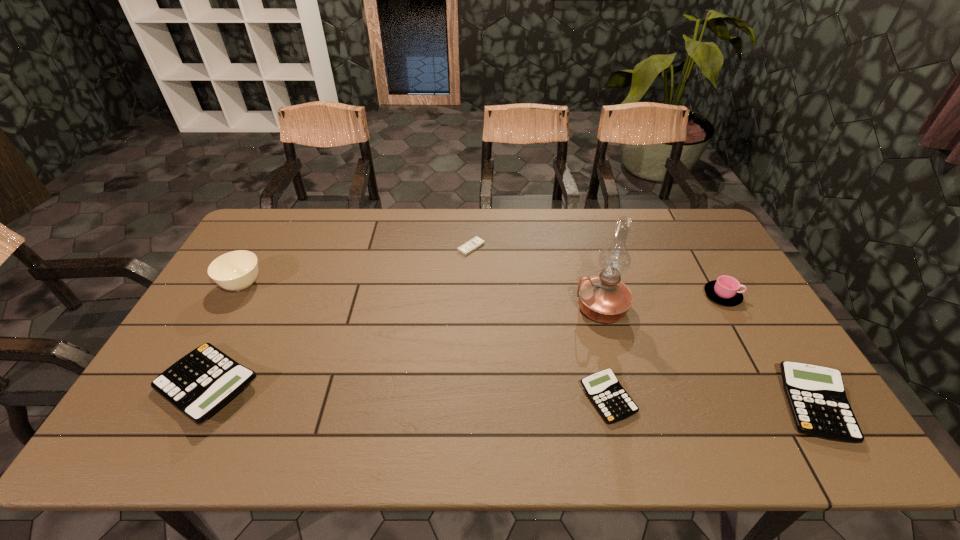
You are a GUI agent. You are given a task and a screenshot of the screen. Output one action in this format:
    pyautogui.click(x=<x>, y=<y>)
    Task: Click on the cup that is at the right edge
    Image resolution: width=960 pixels, height=540 pixels.
    Given the screenshot: What is the action you would take?
    pyautogui.click(x=725, y=290)

Identify the location of object that is at the near left corner. This screenshot has width=960, height=540. click(x=200, y=383).

The width and height of the screenshot is (960, 540). Identify the location of object situated at the near right corner. (816, 395).

You are a GUI agent. You are given a task and a screenshot of the screen. Output one action in this format:
    pyautogui.click(x=<x>, y=<y>)
    Task: Click on the vacant region at the far edge of the desktop
    
    Given the screenshot: What is the action you would take?
    pyautogui.click(x=444, y=237)

Where is `vacant region at the near edge`? The height and width of the screenshot is (540, 960). vacant region at the near edge is located at coordinates (265, 400).

You are a GUI agent. You are given a task and a screenshot of the screen. Output one action in this format:
    pyautogui.click(x=<x>, y=<y>)
    Task: Click on the free space at the right edge
    This screenshot has height=540, width=960.
    Given the screenshot: What is the action you would take?
    pyautogui.click(x=747, y=344)

You are a GUI agent. You are given a task and a screenshot of the screen. Output one action in this format:
    pyautogui.click(x=<x>, y=<y>)
    Task: Click on the vacant space at the far left corner of the desktop
    This screenshot has width=960, height=540.
    Given the screenshot: What is the action you would take?
    pyautogui.click(x=270, y=237)

In order to click on free space at the far right corner of the desktop in this screenshot , I will do `click(704, 245)`.

You are a GUI agent. You are given a task and a screenshot of the screen. Output one action in this format:
    pyautogui.click(x=<x>, y=<y>)
    Task: Click on the free area in between the cup and the oil lamp
    This screenshot has width=960, height=540.
    Given the screenshot: What is the action you would take?
    click(x=661, y=302)

You are a GUI agent. You are given a task and a screenshot of the screen. Output one action in this format:
    pyautogui.click(x=<x>, y=<y>)
    Task: Click on the vacant space that's between the oil lamp and the cup
    The height and width of the screenshot is (540, 960).
    Given the screenshot: What is the action you would take?
    (x=661, y=302)